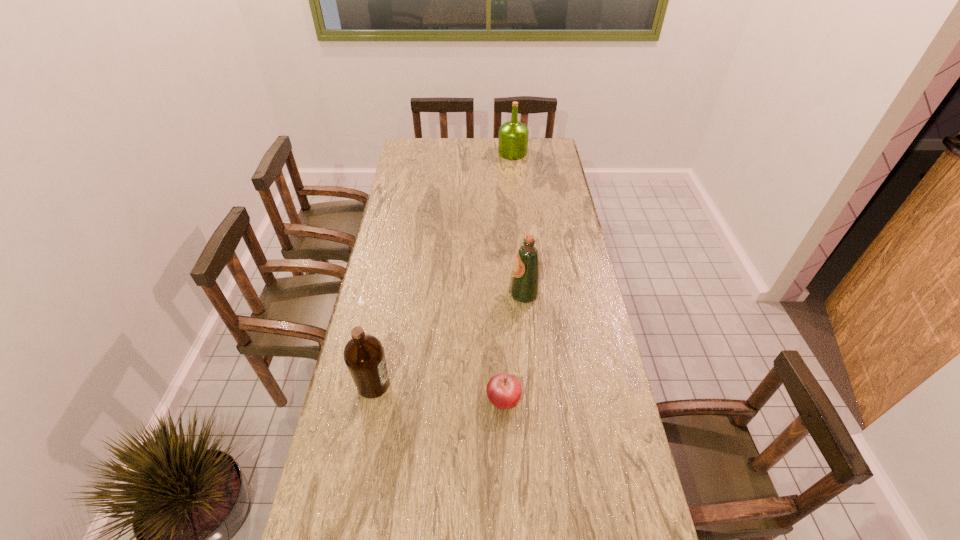
Where is `object that stands as the third closest to the shortest object`? object that stands as the third closest to the shortest object is located at coordinates (513, 135).

At what (x,y) coordinates should I click in order to perform the action: click on object that is the second closest to the nearest olive oil. Please return your answer as a coordinate pair (x, y). Looking at the image, I should click on (524, 286).

Identify which olive oil is the second nearest to the nearest olive oil. Please provide its 2D coordinates. Your answer should be formatted as a tuple, i.e. [(x, y)], where the tuple contains the x and y coordinates of a point satisfying the conditions above.

[(513, 135)]

Point out which olive oil is positioned as the nearest to the nearest olive oil. Please provide its 2D coordinates. Your answer should be formatted as a tuple, i.e. [(x, y)], where the tuple contains the x and y coordinates of a point satisfying the conditions above.

[(524, 286)]

Locate an element on the screen. The image size is (960, 540). vacant space that satisfies the following two spatial constraints: 1. on the label of the leftmost object; 2. on the left side of the apple is located at coordinates (371, 399).

Where is `vacant area that satisfies the following two spatial constraints: 1. on the label of the leftmost object; 2. on the right side of the apple`? vacant area that satisfies the following two spatial constraints: 1. on the label of the leftmost object; 2. on the right side of the apple is located at coordinates (371, 399).